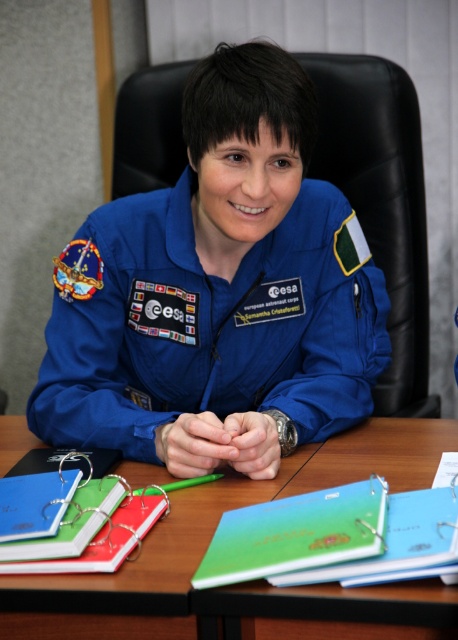
You are an astronaut preparing for a mission and need to place a 15 cm tall model rocket on your desk. Given the wooden table at center and the green matte binder at center, which object can the model rocket be placed on without exceeding its height?

The wooden table at center has a greater height compared to the green matte binder at center, so the model rocket can be placed on the wooden table at center since it is taller and provides enough space.

You are standing in front of the wooden table at center and want to place a small object on the green matte binder at center. Can you reach it without moving your position?

The wooden table at center is closer to the viewer than the green matte binder at center, so you can reach the green matte binder at center by extending your arm over the wooden table at center.